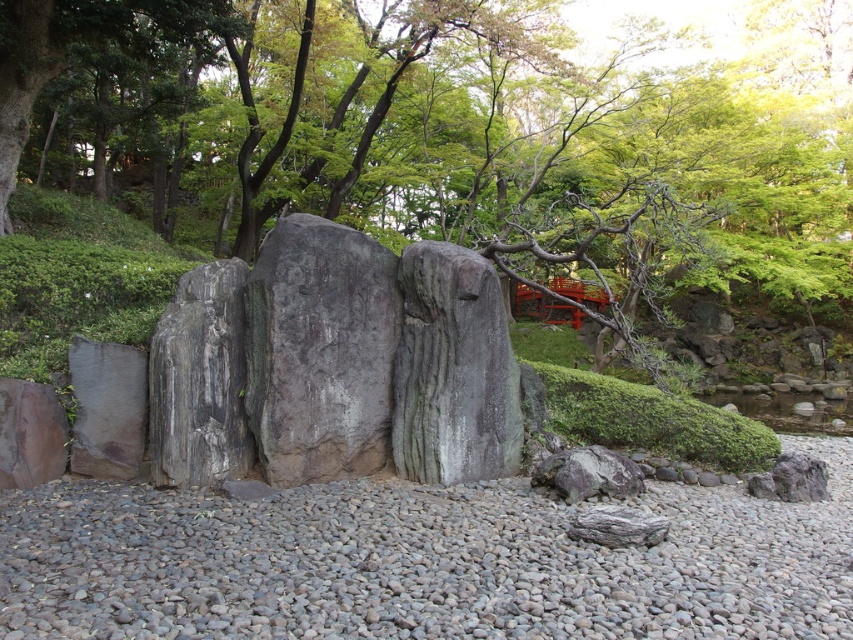
You are a gardener planning to place a small decorative stone on the gray gravel at center. Considering the gray rough rock at center is nearby, which area has more space to accommodate the new stone?

The gray gravel at center might be wider than the gray rough rock at center, so placing the small decorative stone there would likely have more space available.

In the scene shown: You are standing at the entrance of the Japanese garden and want to walk to the three large dark gray boulders in the midground. The gravel pathway is at your feet. According to the image, where is the point at coordinate [421,563] located?

The point at coordinate [421,563] is located on the gray gravel at center, which is part of the gravel pathway in the foreground. This means the point is on the path leading towards the three large dark gray boulders in the midground.